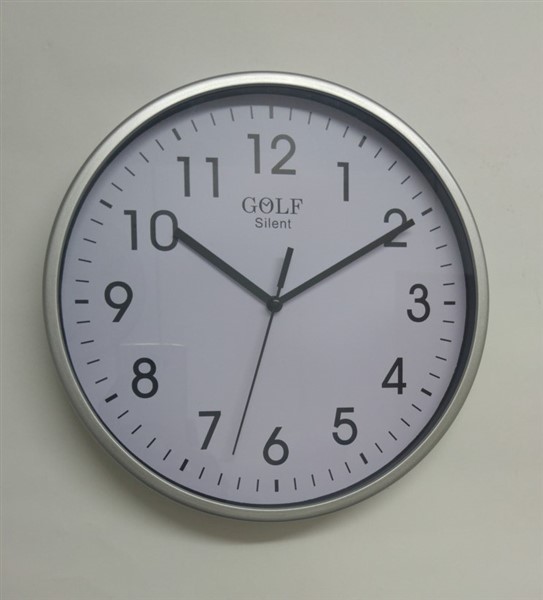
Identify the location of shadow of frame. This screenshot has height=600, width=543. (189, 523), (315, 108).